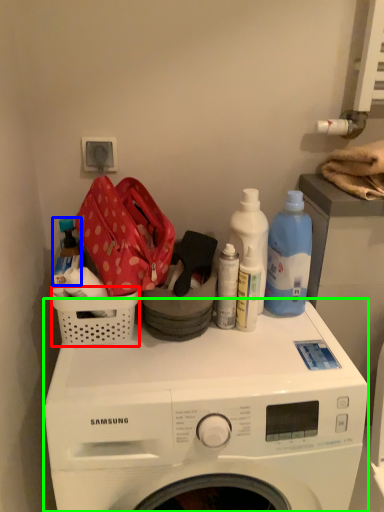
Question: Considering the real-world distances, which object is closest to basket (highlighted by a red box)? bottle (highlighted by a blue box) or washing machine (highlighted by a green box).

Choices:
 (A) bottle
 (B) washing machine

Answer: (A)